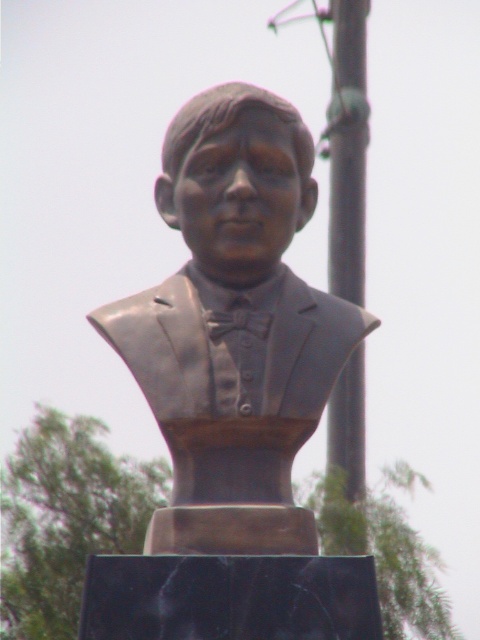
Question: From the image, what is the correct spatial relationship of bronze statue at center in relation to smooth metallic pole at center?

Choices:
 (A) left
 (B) right

Answer: (A)

Question: Is bronze statue at center above smooth metallic pole at center?

Choices:
 (A) yes
 (B) no

Answer: (B)

Question: Does bronze statue at center appear under smooth metallic pole at center?

Choices:
 (A) yes
 (B) no

Answer: (A)

Question: Which point is farther to the camera?

Choices:
 (A) (327, 410)
 (B) (183, 467)

Answer: (A)

Question: Which point is closer to the camera taking this photo?

Choices:
 (A) (299, 163)
 (B) (340, 257)

Answer: (A)

Question: Which of the following is the closest to the observer?

Choices:
 (A) bronze statue at center
 (B) smooth metallic pole at center

Answer: (A)